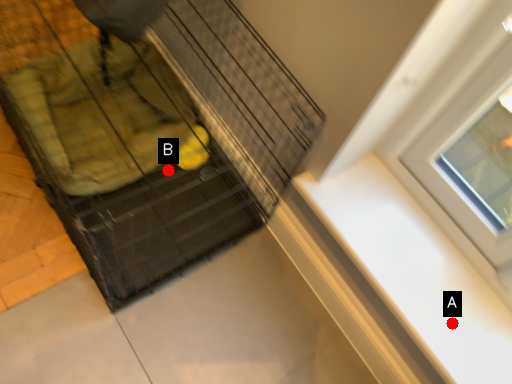
Question: Two points are circled on the image, labeled by A and B beside each circle. Which point is farther from the camera taking this photo?

Choices:
 (A) A is further
 (B) B is further

Answer: (B)